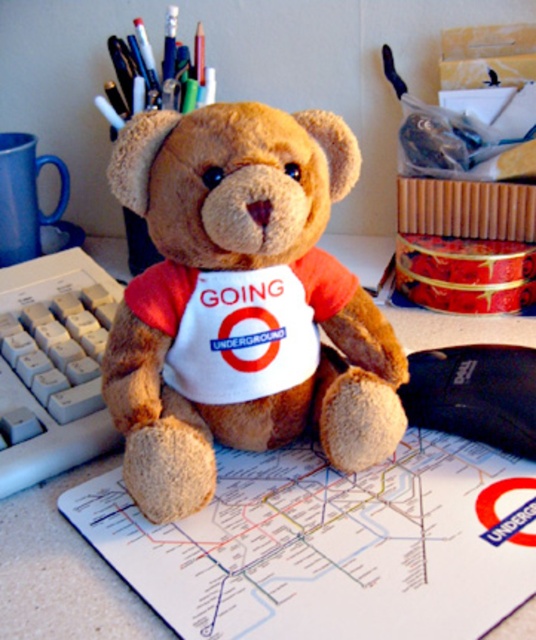
Based on the photo, you are setting up a video call and need to position your camera so that the teddy bear and the white plastic keyboard at left are both clearly visible. Given their current positions, what is the minimum distance you should place the camera from the desk to ensure both are in frame?

The white plastic keyboard at left and camera are 16.94 inches apart. To ensure both the teddy bear and the keyboard are visible, the camera should be placed at least 16.94 inches away from the keyboard, which is the distance between them.

You are organizing your desk and want to place a new cup holder between the white plastic keyboard at left and the black fabric mouse at center. Based on their positions, where should you place the cup holder so it is between them?

The white plastic keyboard at left is to the left of the black fabric mouse at center, so you should place the cup holder between them to the right of the white plastic keyboard at left and to the left of the black fabric mouse at center.

You are organizing your desk and want to place a new item between the white plastic keyboard at left and the black fabric mouse at center. However, the keyboard is covering the mouse. Can you place the new item between them without moving the keyboard or mouse?

The white plastic keyboard at left is positioned over the black fabric mouse at center, so they are not separated by any space. Therefore, you cannot place a new item between them without moving either the keyboard or the mouse.